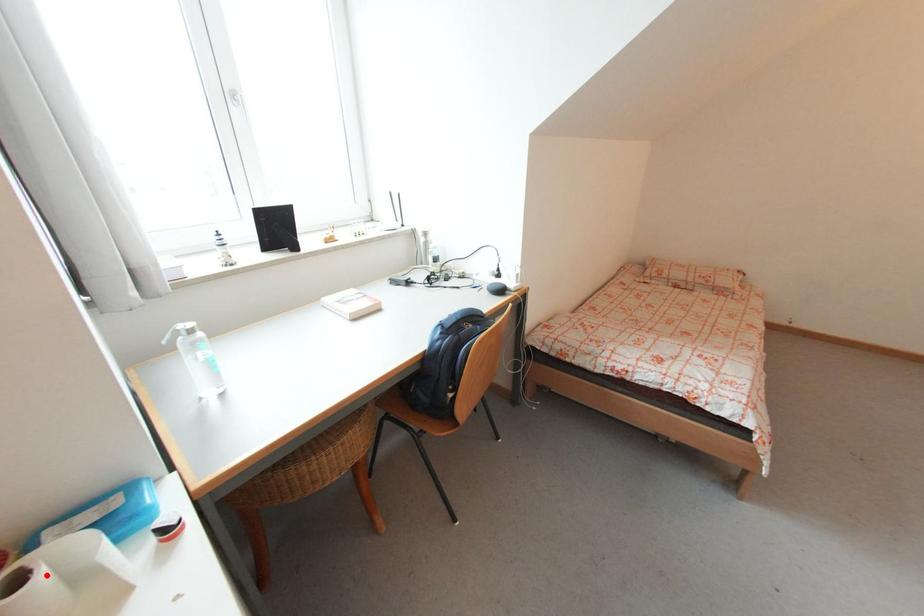
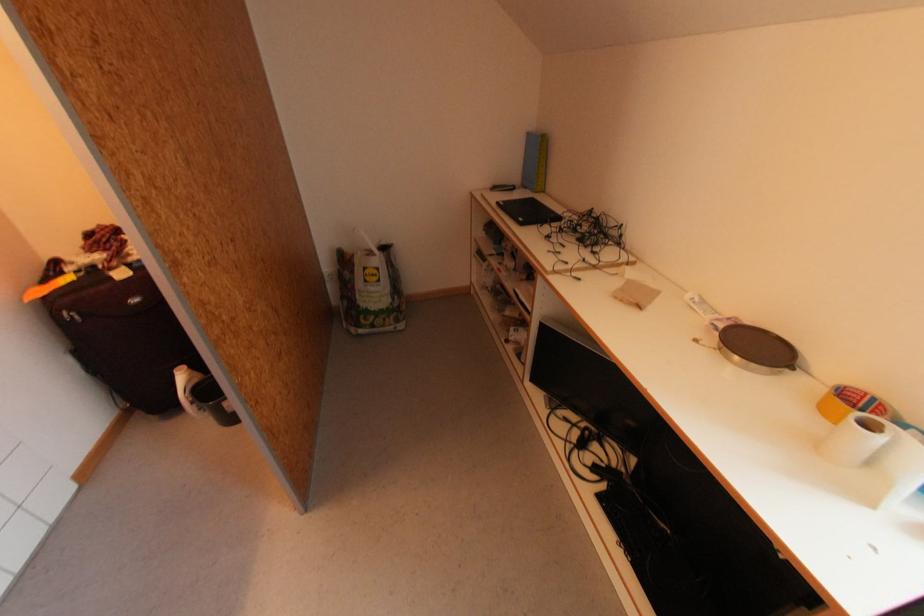
Question: I am providing you with two images of the same scene from different viewpoints. Image1 has a red point marked. In image2, the corresponding 3D location appears at what relative position? Reply with the corresponding letter.

Choices:
 (A) Closer
 (B) Farther

Answer: (B)